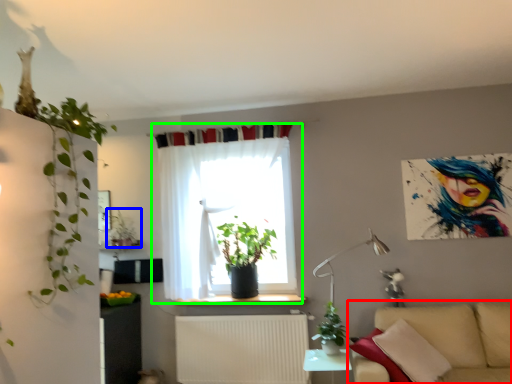
Question: Estimate the real-world distances between objects in this image. Which object is closer to studio couch (highlighted by a red box), houseplant (highlighted by a blue box) or curtain (highlighted by a green box)?

Choices:
 (A) houseplant
 (B) curtain

Answer: (B)